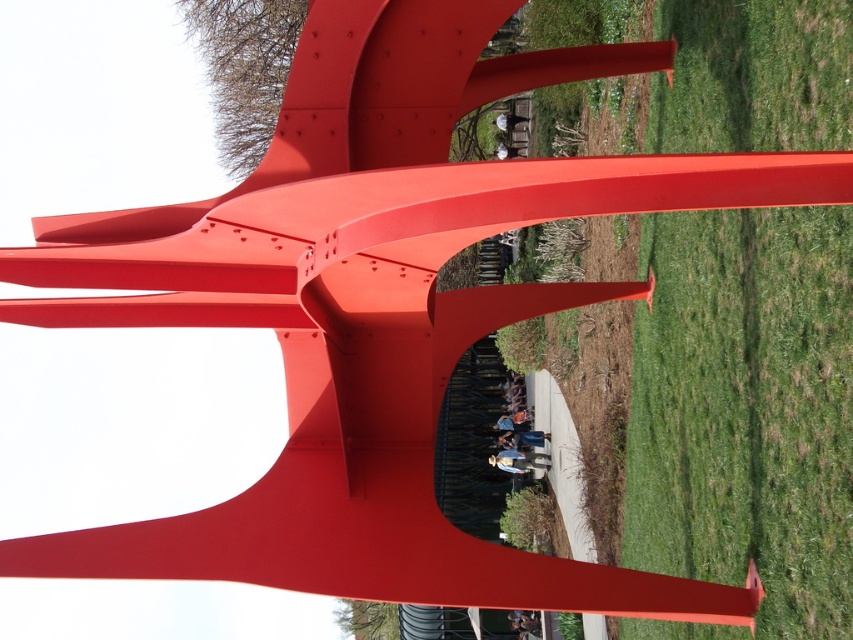
You are a photographer planning to take a picture of the red sculpture. You notice the green grass at center and the dark blue shirt at center in the scene. Which object would you focus on to ensure the sculpture remains the main subject?

The green grass at center is thinner than the dark blue shirt at center, so focusing on the green grass at center would keep the sculpture as the main subject since it has less visual weight.

You are standing in the park and see the large red sculpture. There is green grass at center and a dark blue shirt at center. Which object is higher up in the image?

The green grass at center is located above the dark blue shirt at center, so the green grass at center is higher up in the image.